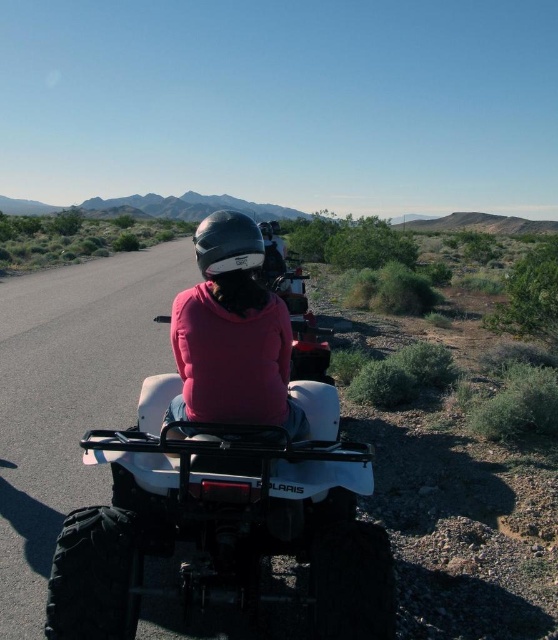
You are a safety inspector checking the helmets of two ATV riders in the desert. You notice both the pink matte helmet at center and the glossy black helmet at center. According to safety regulations, helmets must be visible from above for aerial rescue operations. Which helmet is positioned in a way that might hinder aerial visibility?

The pink matte helmet at center is positioned under the glossy black helmet at center, so it might hinder aerial visibility because it is obscured by the glossy black helmet at center.

You are a photographer positioned at the starting point of the desert ATV trail. You notice two riders ahead wearing the pink matte helmet at center and the glossy black helmet at center. Which rider should you focus your camera on to capture a clearer image without adjusting your position?

The pink matte helmet at center is closer to you than the glossy black helmet at center, so focusing on the pink matte helmet at center will result in a clearer image without moving your position.